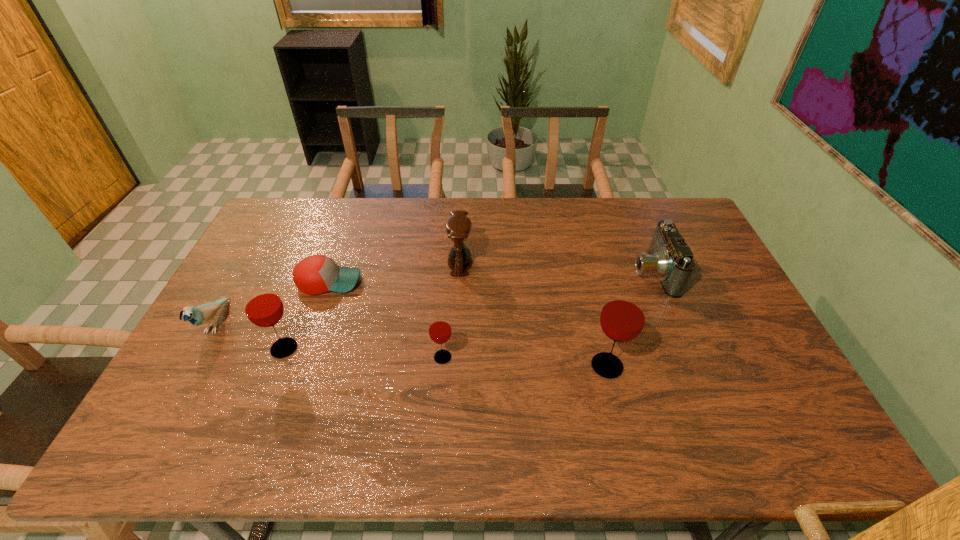
This screenshot has width=960, height=540. I want to click on vacant space that satisfies the following two spatial constraints: 1. on the front side of the hourglass; 2. at the brim of the shortest object, so (459, 281).

The height and width of the screenshot is (540, 960). Identify the location of free space in the image that satisfies the following two spatial constraints: 1. on the back side of the second object from right to left; 2. at the brim of the shortest object. (586, 281).